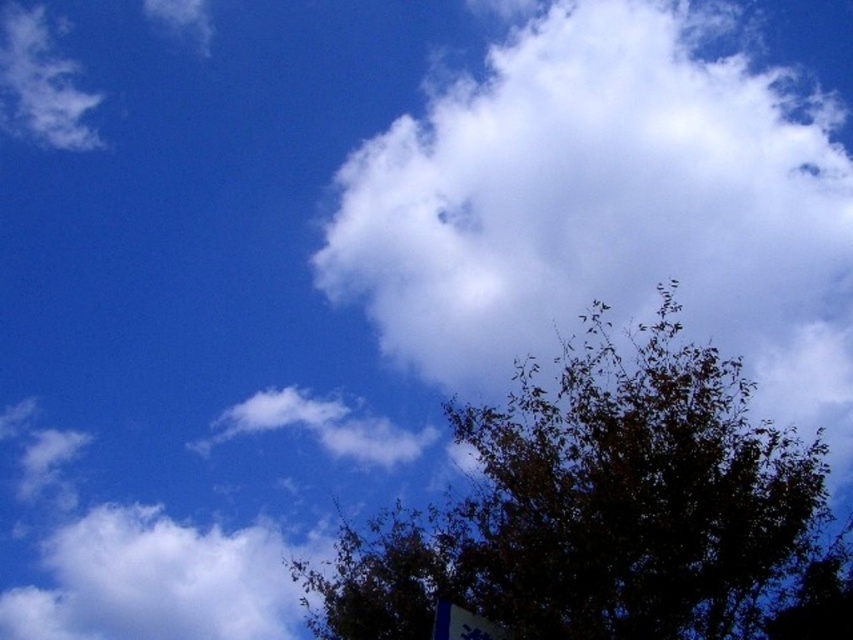
Between point (779, 269) and point (747, 636), which one is positioned in front?

Point (747, 636)

Does white fluffy cloud at upper center have a greater height compared to dark green leafy tree at bottom right?

Yes.

The width and height of the screenshot is (853, 640). Describe the element at coordinates (608, 211) in the screenshot. I see `white fluffy cloud at upper center` at that location.

Where is `white fluffy cloud at upper center`? The height and width of the screenshot is (640, 853). white fluffy cloud at upper center is located at coordinates click(608, 211).

Who is taller, white fluffy cloud at upper center or white fluffy cloud at upper left?

white fluffy cloud at upper center

Can you confirm if white fluffy cloud at upper center is positioned below white fluffy cloud at upper left?

Incorrect, white fluffy cloud at upper center is not positioned below white fluffy cloud at upper left.

Which is behind, point (822, 212) or point (260, 522)?

Positioned behind is point (260, 522).

You are a GUI agent. You are given a task and a screenshot of the screen. Output one action in this format:
    pyautogui.click(x=<x>, y=<y>)
    Task: Click on the white fluffy cloud at upper center
    The width and height of the screenshot is (853, 640).
    Given the screenshot: What is the action you would take?
    pyautogui.click(x=608, y=211)

Which of these two, dark green leafy tree at bottom right or white fluffy cloud at upper left, stands taller?

dark green leafy tree at bottom right is taller.

Based on the photo, which is more to the right, dark green leafy tree at bottom right or white fluffy cloud at upper left?

dark green leafy tree at bottom right

Who is more forward, (689, 483) or (15, 592)?

Point (689, 483)

I want to click on dark green leafy tree at bottom right, so click(x=606, y=513).